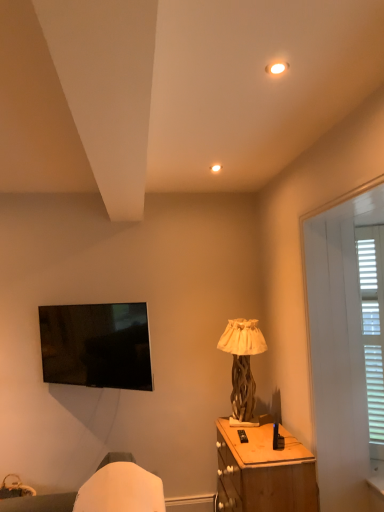
Question: Is wooden textured lamp at center positioned before matte white light fixture at upper center?

Choices:
 (A) no
 (B) yes

Answer: (A)

Question: From a real-world perspective, does wooden textured lamp at center stand above matte white light fixture at upper center?

Choices:
 (A) yes
 (B) no

Answer: (B)

Question: Is wooden textured lamp at center to the right of matte white light fixture at upper center from the viewer's perspective?

Choices:
 (A) yes
 (B) no

Answer: (A)

Question: Is wooden textured lamp at center facing towards matte white light fixture at upper center?

Choices:
 (A) yes
 (B) no

Answer: (B)

Question: Would you say wooden textured lamp at center is outside matte white light fixture at upper center?

Choices:
 (A) yes
 (B) no

Answer: (A)

Question: From a real-world perspective, is white wood screen door at right above or below wooden nightstand at lower right?

Choices:
 (A) above
 (B) below

Answer: (A)

Question: From their relative heights in the image, would you say white wood screen door at right is taller or shorter than wooden nightstand at lower right?

Choices:
 (A) short
 (B) tall

Answer: (B)

Question: Is white wood screen door at right situated inside wooden nightstand at lower right or outside?

Choices:
 (A) outside
 (B) inside

Answer: (A)

Question: Considering the positions of point (349, 452) and point (223, 485), is point (349, 452) closer or farther from the camera than point (223, 485)?

Choices:
 (A) farther
 (B) closer

Answer: (B)

Question: Considering their positions, is wooden textured lamp at center located in front of or behind matte white light fixture at upper center?

Choices:
 (A) front
 (B) behind

Answer: (B)

Question: Is wooden textured lamp at center spatially inside matte white light fixture at upper center, or outside of it?

Choices:
 (A) inside
 (B) outside

Answer: (B)

Question: From their relative heights in the image, would you say wooden textured lamp at center is taller or shorter than matte white light fixture at upper center?

Choices:
 (A) short
 (B) tall

Answer: (B)

Question: Would you say wooden textured lamp at center is to the left or to the right of matte white light fixture at upper center in the picture?

Choices:
 (A) left
 (B) right

Answer: (B)

Question: Considering the positions of matte white light fixture at upper center and wooden textured lamp at center in the image, is matte white light fixture at upper center wider or thinner than wooden textured lamp at center?

Choices:
 (A) wide
 (B) thin

Answer: (B)

Question: From a real-world perspective, is matte white light fixture at upper center above or below wooden textured lamp at center?

Choices:
 (A) below
 (B) above

Answer: (B)